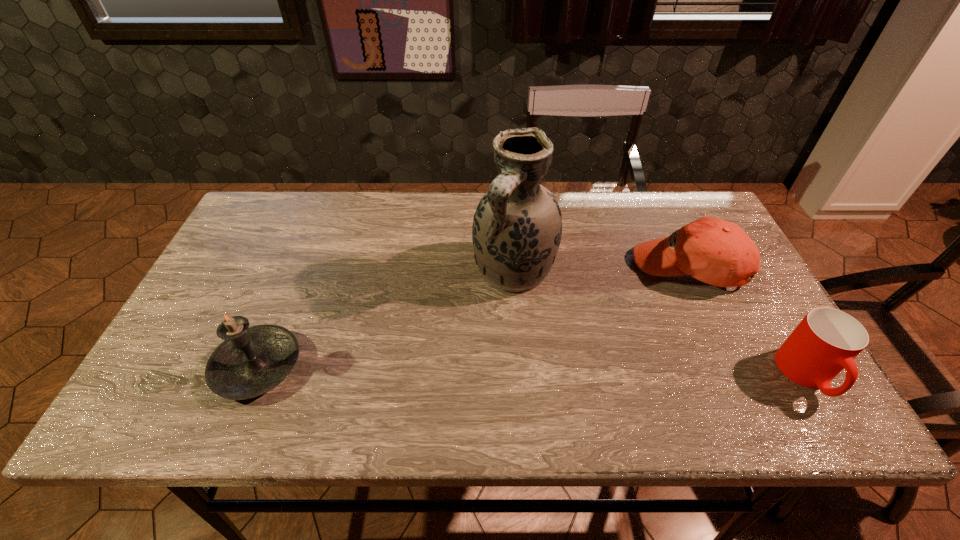
Where is `free space that satisfies the following two spatial constraints: 1. on the back side of the vase; 2. on the right side of the candle`? free space that satisfies the following two spatial constraints: 1. on the back side of the vase; 2. on the right side of the candle is located at coordinates (297, 271).